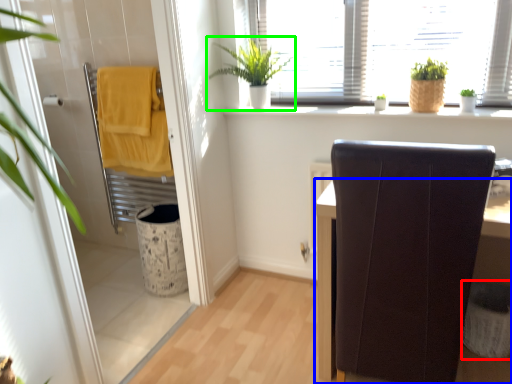
Question: Which object is the farthest from laundry basket (highlighted by a red box)? Choose among these: furniture (highlighted by a blue box) or houseplant (highlighted by a green box).

Choices:
 (A) furniture
 (B) houseplant

Answer: (B)